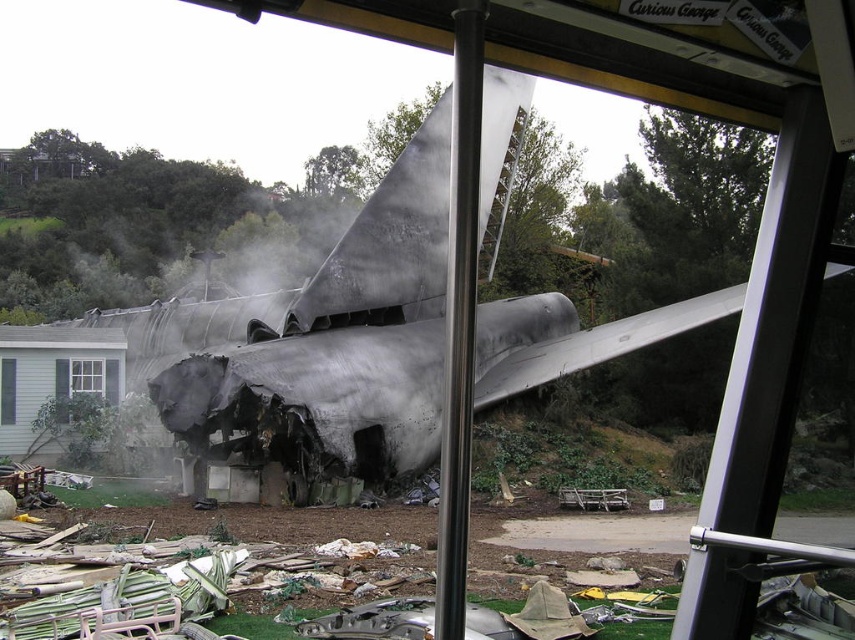
Question: Which point appears farthest from the camera in this image?

Choices:
 (A) (10, 403)
 (B) (68, 380)

Answer: (B)

Question: Does gray wood window at lower left come behind white plastic window at lower left?

Choices:
 (A) no
 (B) yes

Answer: (B)

Question: Which object appears closest to the camera in this image?

Choices:
 (A) gray wood window at lower left
 (B) white plastic window at lower left

Answer: (B)

Question: Does gray wood window at lower left come in front of white plastic window at lower left?

Choices:
 (A) no
 (B) yes

Answer: (A)

Question: Is gray wood window at lower left positioned before white plastic window at lower left?

Choices:
 (A) no
 (B) yes

Answer: (A)